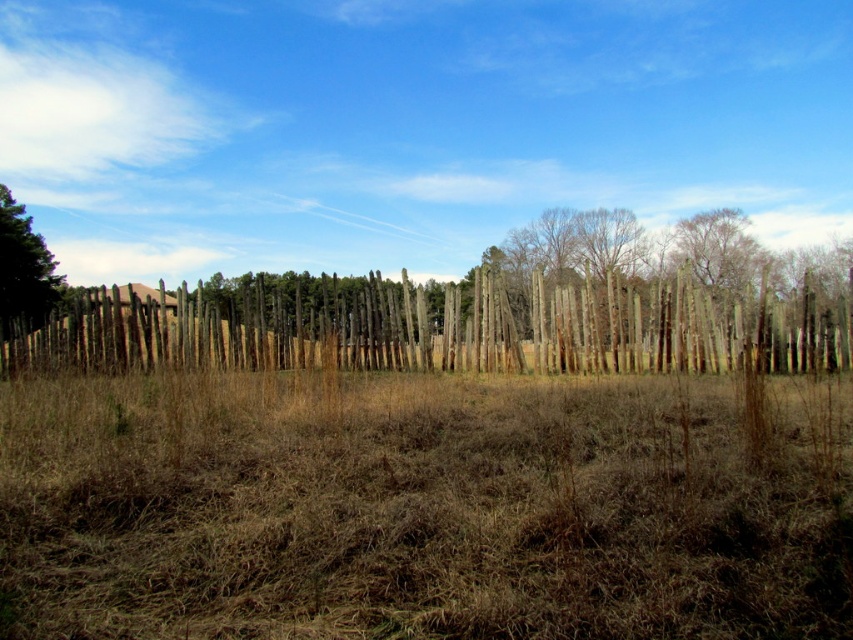
You are standing at the point marked by the coordinates point [424,508] in the image. What is the immediate surface you would be touching if you were to kneel down?

The immediate surface you would be touching is the brown dry grass at center, as the point [424,508] indicates brown dry grass at center.

You are standing in the rural landscape and want to walk towards the green textured tree at left. Is the wooden fence at center blocking your path? Explain why.

The wooden fence at center is closer to the viewer than the green textured tree at left. Therefore, the wooden fence at center would block your path to the green textured tree at left since it is in front of it.